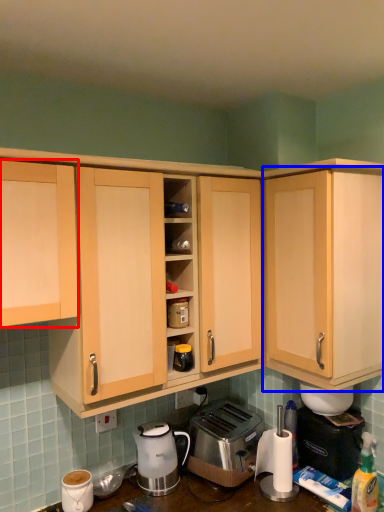
Question: Which object is closer to the camera taking this photo, cabinetry (highlighted by a red box) or cabinetry (highlighted by a blue box)?

Choices:
 (A) cabinetry
 (B) cabinetry

Answer: (A)